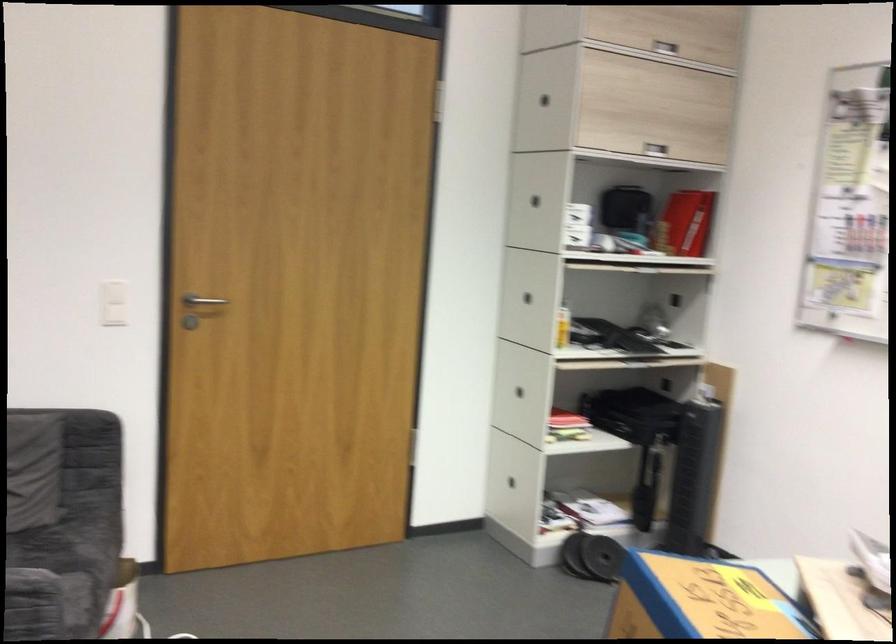
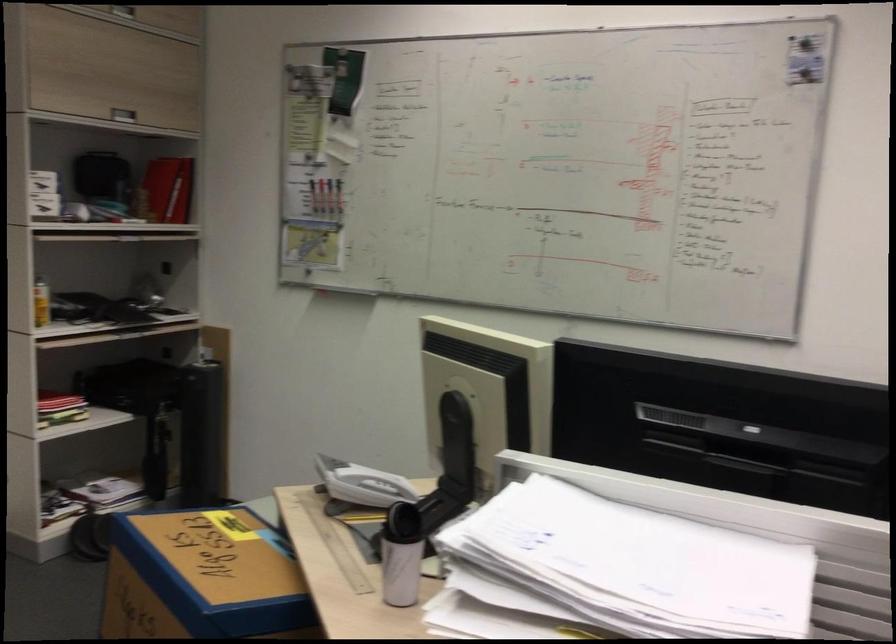
Locate, in the second image, the point that corresponds to (x=714, y=397) in the first image.

(213, 359)